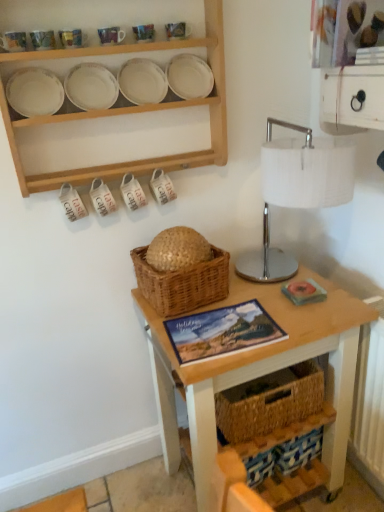
The width and height of the screenshot is (384, 512). I want to click on free space above wooden table at center (from a real-world perspective), so click(247, 309).